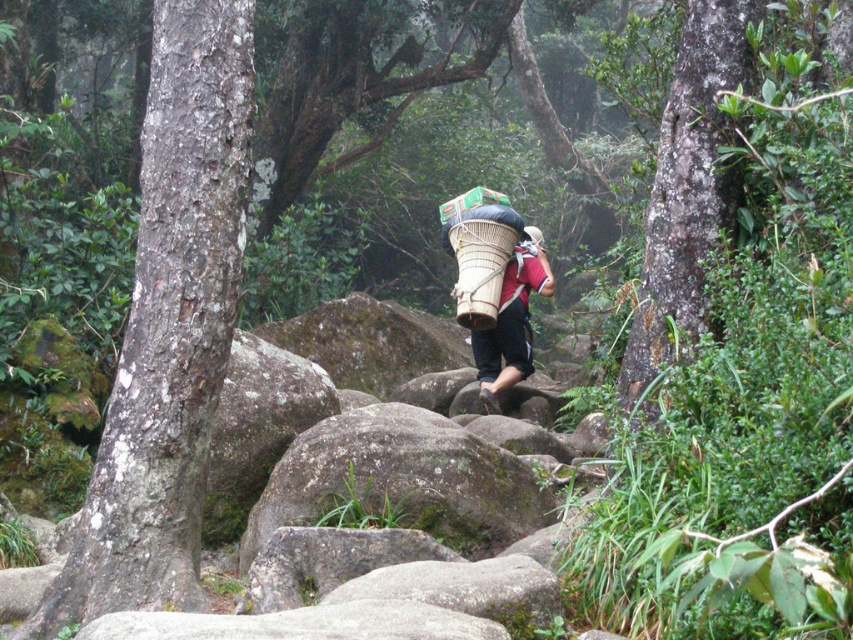
Is green mossy rock at center positioned before matte brown basket at center?

Yes.

Does point (376, 433) come in front of point (509, 257)?

Yes.

Image resolution: width=853 pixels, height=640 pixels. What are the coordinates of `green mossy rock at center` in the screenshot? It's located at (402, 481).

Does matte brown basket at center lie in front of bamboo woven basket at center?

No, it is not.

Does matte brown basket at center have a lesser height compared to bamboo woven basket at center?

Incorrect, matte brown basket at center's height does not fall short of bamboo woven basket at center's.

Does point (497, 323) lie behind point (512, 248)?

Yes, it is behind point (512, 248).

Image resolution: width=853 pixels, height=640 pixels. I want to click on matte brown basket at center, so click(x=503, y=305).

From the picture: Is rough bark tree trunk at left taller than white matte helmet at center?

Indeed, rough bark tree trunk at left has a greater height compared to white matte helmet at center.

Does rough bark tree trunk at left appear over white matte helmet at center?

No, rough bark tree trunk at left is not above white matte helmet at center.

Is point (165, 588) positioned in front of point (534, 230)?

Yes, it is.

Find the location of `rough bark tree trunk at left`. rough bark tree trunk at left is located at coordinates [x=167, y=326].